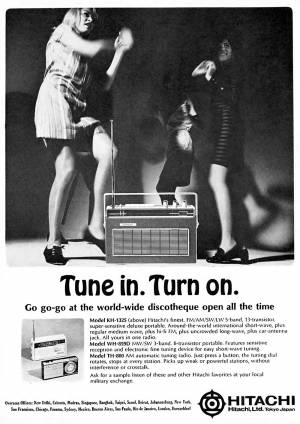
The width and height of the screenshot is (300, 424). In order to click on speaker grill in this screenshot , I will do `click(51, 371)`, `click(143, 240)`.